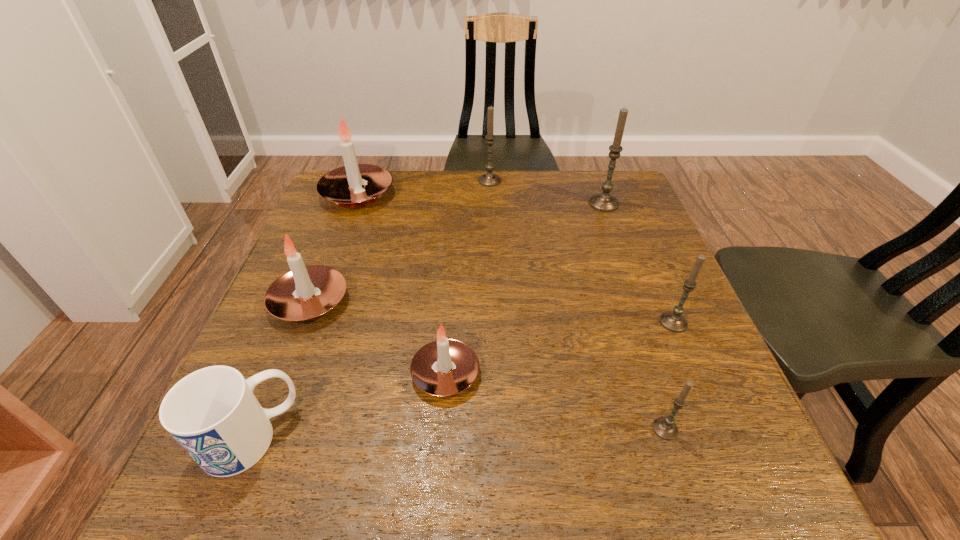
Locate an element on the screen. The height and width of the screenshot is (540, 960). empty location between the second biggest gray candle and the second biggest white candle is located at coordinates (399, 241).

You are a GUI agent. You are given a task and a screenshot of the screen. Output one action in this format:
    pyautogui.click(x=<x>, y=<y>)
    Task: Click on the object that is the fourth closest one to the second nearest white candle
    The height and width of the screenshot is (540, 960).
    Given the screenshot: What is the action you would take?
    pyautogui.click(x=488, y=179)

Locate an element on the screen. The image size is (960, 540). object that ranks as the second closest to the nearest gray candle is located at coordinates (444, 367).

Select which candle is the closest to the second farthest gray candle. Please provide its 2D coordinates. Your answer should be formatted as a tuple, i.e. [(x, y)], where the tuple contains the x and y coordinates of a point satisfying the conditions above.

[(488, 179)]

Select which candle appears as the fifth closest to the tallest object. Please provide its 2D coordinates. Your answer should be formatted as a tuple, i.e. [(x, y)], where the tuple contains the x and y coordinates of a point satisfying the conditions above.

[(665, 427)]

Locate an element on the screen. gray candle that is the second closest to the third nearest gray candle is located at coordinates (673, 320).

Select which gray candle is the third closest to the smallest white candle. Please provide its 2D coordinates. Your answer should be formatted as a tuple, i.e. [(x, y)], where the tuple contains the x and y coordinates of a point satisfying the conditions above.

[(604, 201)]

Identify the location of the closest white candle to the farthest white candle. (304, 293).

Find the location of `the closest white candle to the mug`. the closest white candle to the mug is located at coordinates (304, 293).

The image size is (960, 540). I want to click on free space that satisfies the following two spatial constraints: 1. on the back side of the third biggest gray candle; 2. on the right side of the nearest candle, so click(630, 322).